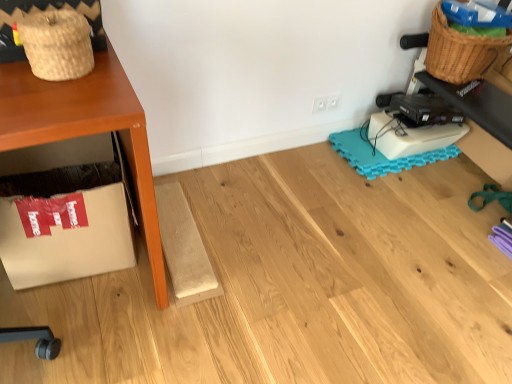
Question: Is white cardboard box at lower left shorter than teal foam mat at lower right?

Choices:
 (A) no
 (B) yes

Answer: (A)

Question: Considering the relative sizes of white cardboard box at lower left and teal foam mat at lower right in the image provided, is white cardboard box at lower left bigger than teal foam mat at lower right?

Choices:
 (A) no
 (B) yes

Answer: (B)

Question: Considering the relative sizes of white cardboard box at lower left and teal foam mat at lower right in the image provided, is white cardboard box at lower left smaller than teal foam mat at lower right?

Choices:
 (A) yes
 (B) no

Answer: (B)

Question: Is white cardboard box at lower left further to camera compared to teal foam mat at lower right?

Choices:
 (A) yes
 (B) no

Answer: (B)

Question: Considering the relative sizes of white cardboard box at lower left and teal foam mat at lower right in the image provided, is white cardboard box at lower left taller than teal foam mat at lower right?

Choices:
 (A) yes
 (B) no

Answer: (A)

Question: In terms of width, does white cardboard box at lower left look wider or thinner when compared to woven straw basket at upper left, which is counted as the second basket, starting from the right?

Choices:
 (A) wide
 (B) thin

Answer: (A)

Question: From a real-world perspective, is white cardboard box at lower left above or below woven straw basket at upper left, which is the first basket from left to right?

Choices:
 (A) below
 (B) above

Answer: (A)

Question: From the image's perspective, is white cardboard box at lower left positioned above or below woven straw basket at upper left, marked as the first basket in a front-to-back arrangement?

Choices:
 (A) above
 (B) below

Answer: (B)

Question: Choose the correct answer: Is white cardboard box at lower left inside woven straw basket at upper left, the 2th basket from the back, or outside it?

Choices:
 (A) inside
 (B) outside

Answer: (B)

Question: Considering the positions of teal foam mat at lower right and woven brown basket at upper right, the first basket in the top-to-bottom sequence, in the image, is teal foam mat at lower right wider or thinner than woven brown basket at upper right, the first basket in the top-to-bottom sequence,?

Choices:
 (A) wide
 (B) thin

Answer: (A)

Question: Is teal foam mat at lower right inside the boundaries of woven brown basket at upper right, which is the 1th basket in right-to-left order, or outside?

Choices:
 (A) outside
 (B) inside

Answer: (A)

Question: Would you say teal foam mat at lower right is to the left or to the right of woven brown basket at upper right, positioned as the first basket in back-to-front order, in the picture?

Choices:
 (A) right
 (B) left

Answer: (B)

Question: From a real-world perspective, relative to woven brown basket at upper right, positioned as the first basket in back-to-front order, is teal foam mat at lower right vertically above or below?

Choices:
 (A) below
 (B) above

Answer: (A)

Question: Would you say teal foam mat at lower right is to the left or to the right of woven straw basket at upper left, which is the second basket in top-to-bottom order, in the picture?

Choices:
 (A) right
 (B) left

Answer: (A)

Question: From a real-world perspective, relative to woven straw basket at upper left, the 1th basket from the bottom, is teal foam mat at lower right vertically above or below?

Choices:
 (A) above
 (B) below

Answer: (B)